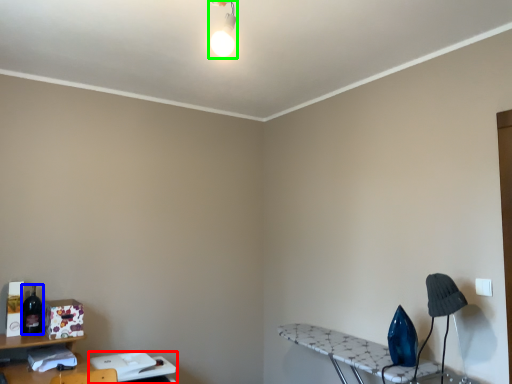
Question: Considering the real-world distances, which object is farthest from table (highlighted by a red box)? bottle (highlighted by a blue box) or light fixture (highlighted by a green box)?

Choices:
 (A) bottle
 (B) light fixture

Answer: (B)